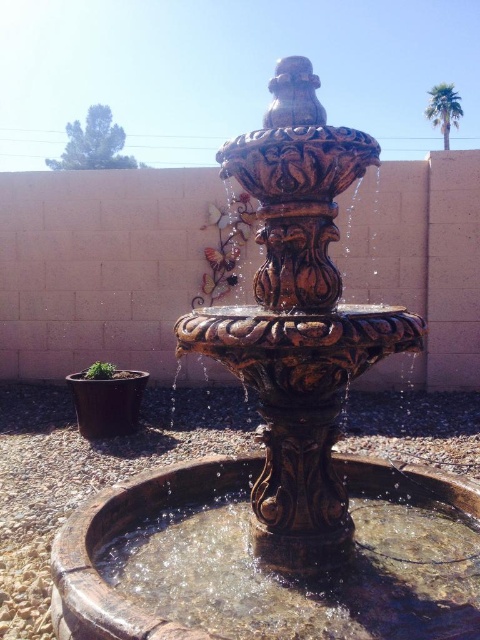
Question: Which object is farther from the camera taking this photo?

Choices:
 (A) clear glass water at center
 (B) green leafy palm at upper right

Answer: (B)

Question: Does clear glass water at center appear over green leafy palm at upper right?

Choices:
 (A) yes
 (B) no

Answer: (B)

Question: Is clear glass water at center further to camera compared to green leafy palm at upper right?

Choices:
 (A) no
 (B) yes

Answer: (A)

Question: Which object appears closest to the camera in this image?

Choices:
 (A) clear glass water at center
 (B) green leafy palm at upper right

Answer: (A)

Question: Can you confirm if clear glass water at center is bigger than green leafy palm at upper right?

Choices:
 (A) no
 (B) yes

Answer: (A)